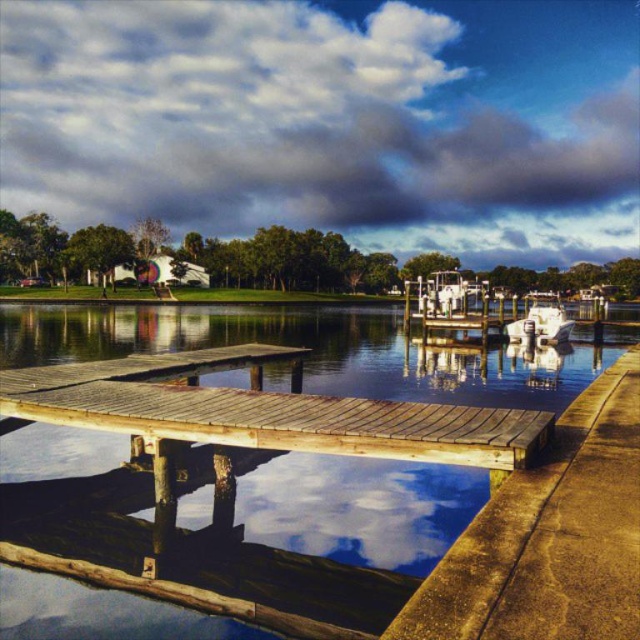
You are standing at the edge of the lake and want to walk to the smooth wooden dock at center. Based on its 2D coordinates, which direction should you head towards?

The smooth wooden dock at center is located at coordinates point (307, 344), so you should head towards the center of the image to reach it.

You are standing at the wooden dock in the foreground and want to locate two points in the scene. The first point is at coordinates point (32, 396) and the second is at point (540, 333). Which point is closer to you?

Point (32, 396) is in front of point (540, 333), so the first point is closer to you.

In the scene shown: You are standing on the smooth wooden dock at center and want to move to the weathered wood dock at center. Which direction should you go to reach it?

The smooth wooden dock at center is bigger than weathered wood dock at center, so you should move towards the smaller dock in the center to reach the weathered wood dock at center.